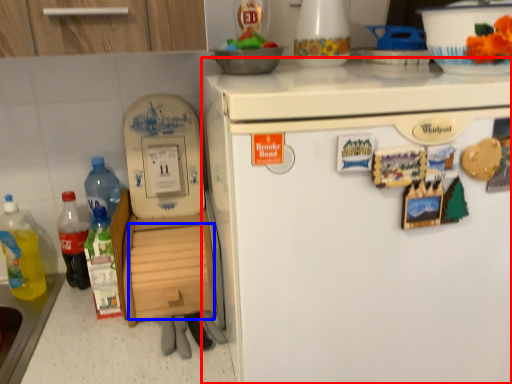
Question: Which object is closer to the camera taking this photo, refrigerator (highlighted by a red box) or drawer (highlighted by a blue box)?

Choices:
 (A) refrigerator
 (B) drawer

Answer: (A)